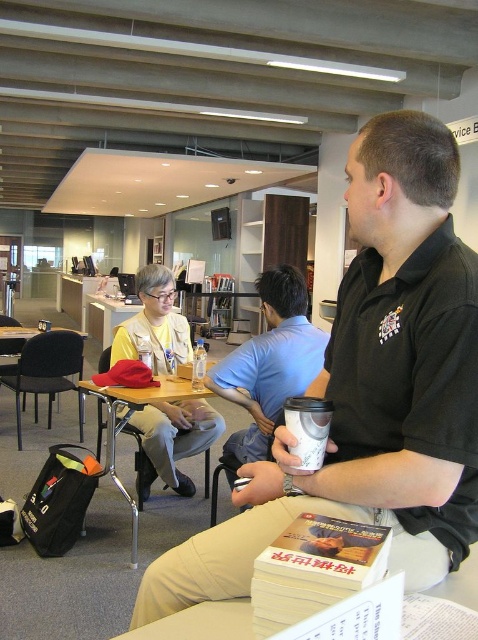
Which is below, black matte shirt at upper right or white paper cup at center?

white paper cup at center

Is black matte shirt at upper right taller than white paper cup at center?

Correct, black matte shirt at upper right is much taller as white paper cup at center.

Is point (386, 250) farther from camera compared to point (318, 456)?

That is True.

The height and width of the screenshot is (640, 478). I want to click on black matte shirt at upper right, so click(371, 387).

Looking at this image, does white paper cup at center have a larger size compared to matte plastic chair at center?

A: Actually, white paper cup at center might be smaller than matte plastic chair at center.

Who is shorter, white paper cup at center or matte plastic chair at center?

Standing shorter between the two is white paper cup at center.

The image size is (478, 640). Identify the location of white paper cup at center. (307, 429).

I want to click on white paper cup at center, so click(307, 429).

From the picture: How much distance is there between blue cotton shirt at center and wooden table at center?

blue cotton shirt at center is 18.37 inches away from wooden table at center.

Does blue cotton shirt at center have a greater width compared to wooden table at center?

No.

Is point (278, 304) positioned behind point (110, 472)?

No, it is in front of (110, 472).

I want to click on blue cotton shirt at center, so click(x=268, y=368).